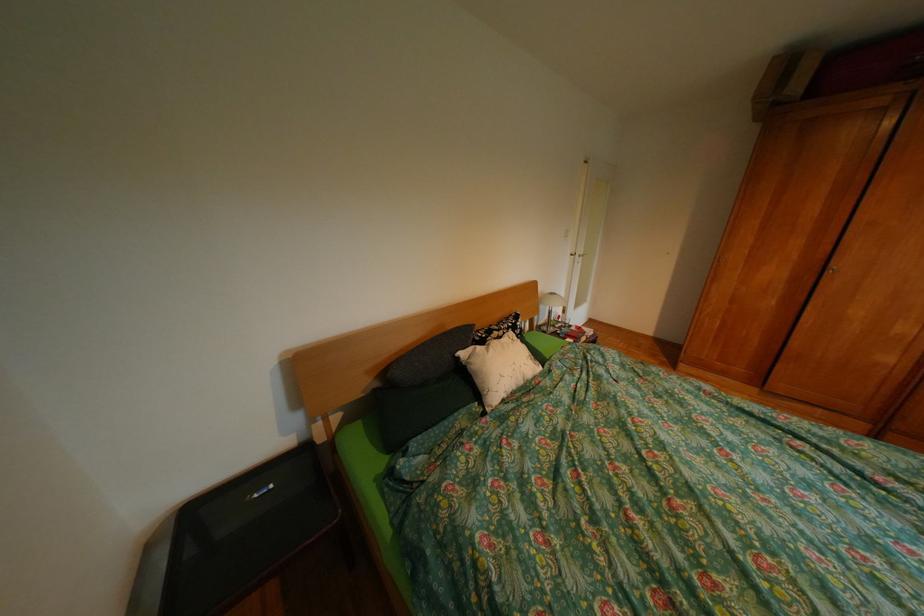
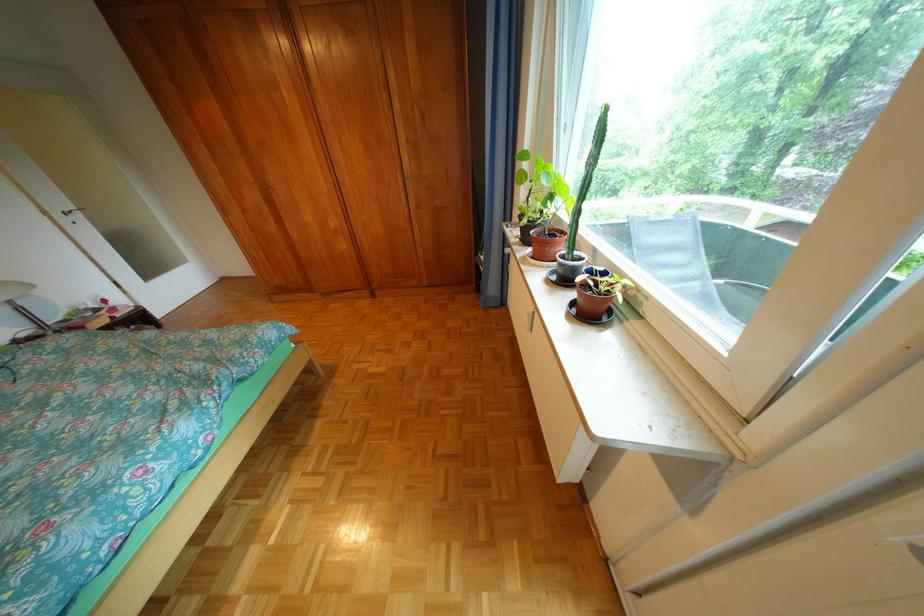
The point at (591, 257) is marked in the first image. Where is the corresponding point in the second image?

(73, 216)